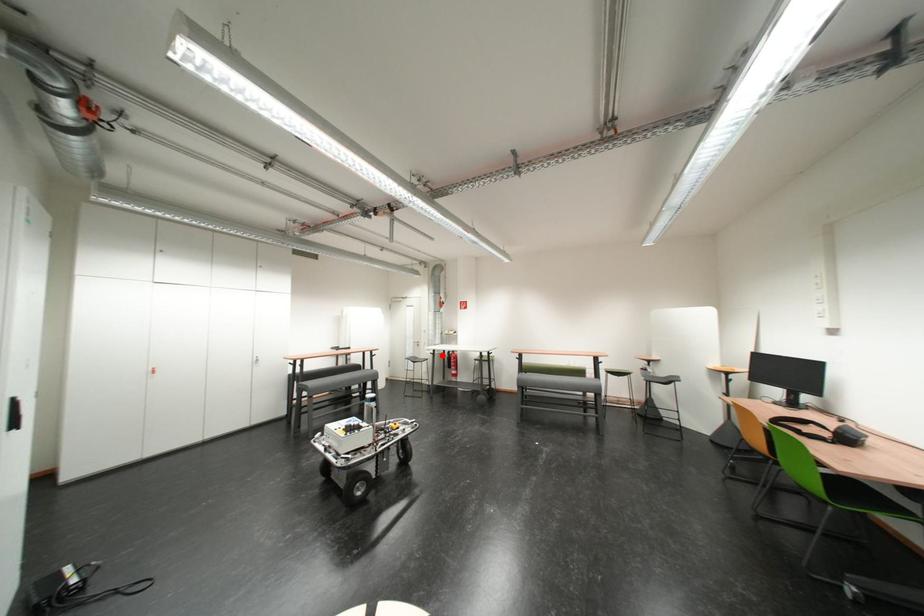
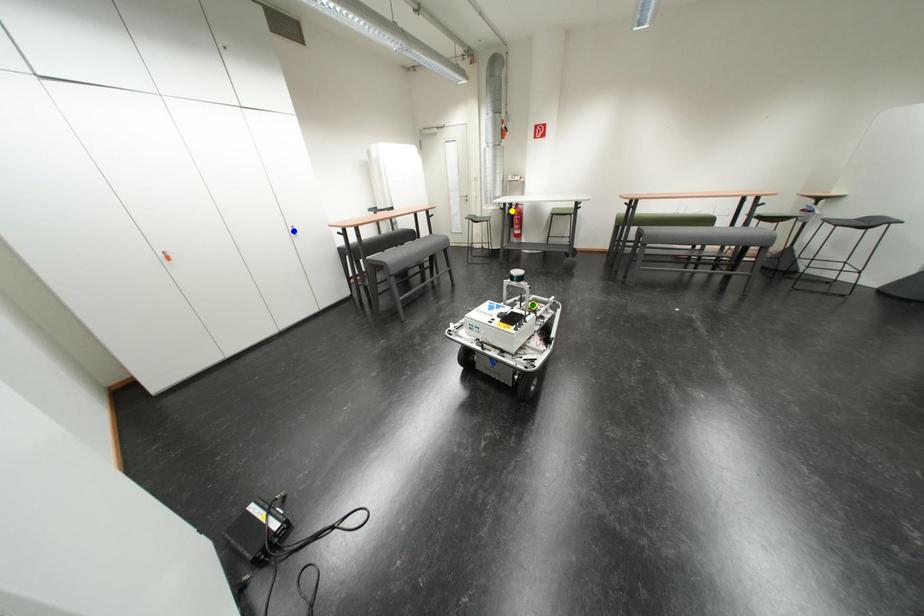
Question: I am providing you with two images of the same scene from different viewpoints. A red point is marked on the first image. You are given multiple points on the second image. Which mark in image 2 goes with the point in image 1?

Choices:
 (A) green point
 (B) blue point
 (C) yellow point

Answer: (C)